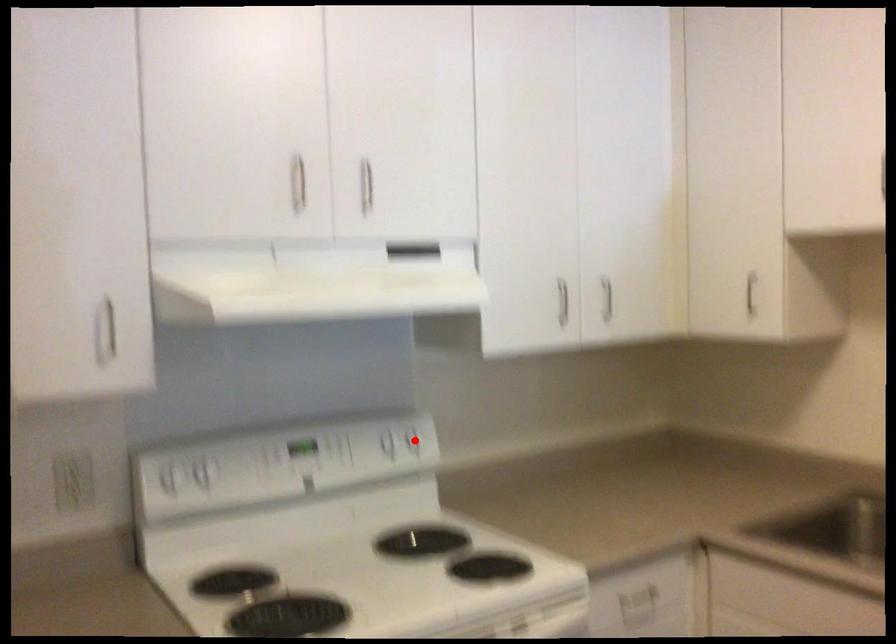
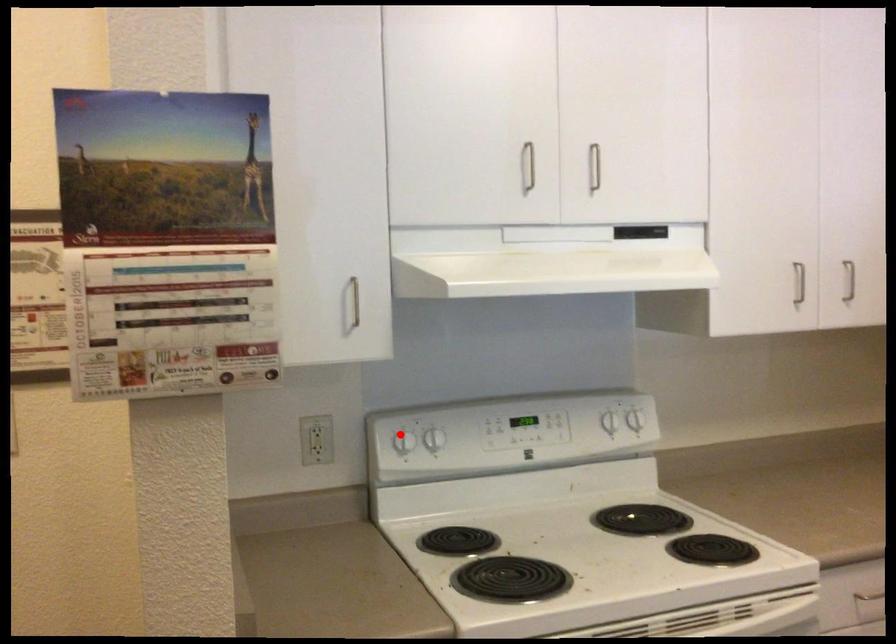
I am providing you with two images of the same scene from different viewpoints. A red point is marked on the first image and another point is marked on the second image. Does the point marked in image1 correspond to the same location as the one in image2?

No